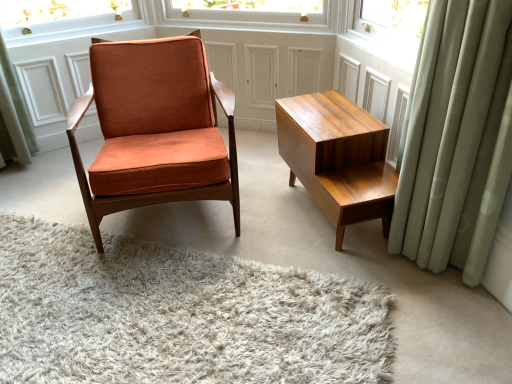
This screenshot has width=512, height=384. What do you see at coordinates (153, 122) in the screenshot?
I see `orange velvet chair at center` at bounding box center [153, 122].

Identify the location of white shag rug at center. This screenshot has height=384, width=512. pos(178,315).

In order to face white shag rug at center, should I rotate leftwards or rightwards?

To align with it, rotate left about 18.058°.

At what (x,y) coordinates should I click in order to perform the action: click on wooden table at right. Please return your answer as a coordinate pair (x, y). The width and height of the screenshot is (512, 384). Looking at the image, I should click on (338, 158).

Is white shag rug at center not inside light green fabric curtain at right?

Indeed, white shag rug at center is completely outside light green fabric curtain at right.

Looking at this image, from a real-world perspective, which object rests below the other?

white shag rug at center is physically lower.

Is white shag rug at center facing towards light green fabric curtain at right?

No, white shag rug at center is not oriented towards light green fabric curtain at right.

Locate an element on the screen. The image size is (512, 384). curtain behind the white shag rug at center is located at coordinates (456, 138).

Is wooden table at right inside or outside of light green fabric curtain at right?

wooden table at right lies outside light green fabric curtain at right.

Is wooden table at right beside light green fabric curtain at right?

There is a gap between wooden table at right and light green fabric curtain at right.

From the image's perspective, is wooden table at right located above light green fabric curtain at right?

No.

Considering the sizes of objects wooden table at right and light green fabric curtain at right in the image provided, who is smaller, wooden table at right or light green fabric curtain at right?

With smaller size is wooden table at right.

Between white shag rug at center and orange velvet chair at center, which one has larger width?

Wider between the two is white shag rug at center.

Considering the positions of points (121, 326) and (184, 183), is point (121, 326) closer to camera compared to point (184, 183)?

That is True.

Which object is positioned more to the right, white shag rug at center or orange velvet chair at center?

orange velvet chair at center is more to the right.

Looking at this image, is white shag rug at center oriented away from orange velvet chair at center?

No, white shag rug at center is not facing away from orange velvet chair at center.

From the image's perspective, is orange velvet chair at center on wooden table at right?

Yes, from the image's perspective, orange velvet chair at center is above wooden table at right.

In terms of height, does orange velvet chair at center look taller or shorter compared to wooden table at right?

Considering their sizes, orange velvet chair at center has more height than wooden table at right.

Is orange velvet chair at center not inside wooden table at right?

Absolutely, orange velvet chair at center is external to wooden table at right.

Which object is positioned more to the left, orange velvet chair at center or wooden table at right?

orange velvet chair at center.

Which object is further away from the camera, white shag rug at center or wooden table at right?

Positioned behind is wooden table at right.

Which object is thinner, white shag rug at center or wooden table at right?

With smaller width is wooden table at right.

Is white shag rug at center at the right side of wooden table at right?

No, white shag rug at center is not to the right of wooden table at right.

Is white shag rug at center oriented away from wooden table at right?

No.

Based on their positions, is wooden table at right located to the left or right of orange velvet chair at center?

From the image, it's evident that wooden table at right is to the right of orange velvet chair at center.

Is wooden table at right turned away from orange velvet chair at center?

That's not correct — wooden table at right is not looking away from orange velvet chair at center.

In the scene shown: From the image's perspective, is wooden table at right beneath orange velvet chair at center?

Yes, from the image's perspective, wooden table at right is beneath orange velvet chair at center.

Based on the photo, does wooden table at right have a smaller size compared to orange velvet chair at center?

Yes.

Would you say light green fabric curtain at right is to the left or to the right of wooden table at right in the picture?

From the image, it's evident that light green fabric curtain at right is to the right of wooden table at right.

Is light green fabric curtain at right taller than wooden table at right?

Yes, light green fabric curtain at right is taller than wooden table at right.

Considering the relative sizes of light green fabric curtain at right and wooden table at right in the image provided, is light green fabric curtain at right wider than wooden table at right?

No.

The image size is (512, 384). Identify the location of curtain above the white shag rug at center (from a real-world perspective). (456, 138).

Locate an element on the screen. This screenshot has width=512, height=384. curtain in front of the wooden table at right is located at coordinates (456, 138).

Estimate the real-world distances between objects in this image. Which object is closer to light green fabric curtain at right, orange velvet chair at center or wooden table at right?

The object closer to light green fabric curtain at right is wooden table at right.

Looking at the image, which one is located further to wooden table at right, orange velvet chair at center or light green fabric curtain at right?

Among the two, orange velvet chair at center is located further to wooden table at right.

Estimate the real-world distances between objects in this image. Which object is closer to white shag rug at center, orange velvet chair at center or light green fabric curtain at right?

orange velvet chair at center lies closer to white shag rug at center than the other object.

Considering their positions, is light green fabric curtain at right positioned closer to white shag rug at center than orange velvet chair at center?

The object closer to white shag rug at center is orange velvet chair at center.

From the image, which object appears to be farther from white shag rug at center, orange velvet chair at center or wooden table at right?

wooden table at right.

Looking at the image, which one is located further to wooden table at right, light green fabric curtain at right or orange velvet chair at center?

Among the two, orange velvet chair at center is located further to wooden table at right.

Considering their positions, is white shag rug at center positioned further to wooden table at right than orange velvet chair at center?

white shag rug at center lies further to wooden table at right than the other object.

Looking at the image, which one is located closer to white shag rug at center, wooden table at right or light green fabric curtain at right?

wooden table at right.

At what (x,y) coordinates should I click in order to perform the action: click on chair between white shag rug at center and wooden table at right. Please return your answer as a coordinate pair (x, y). The width and height of the screenshot is (512, 384). Looking at the image, I should click on (153, 122).

Where is `table located between orange velvet chair at center and light green fabric curtain at right in the left-right direction`? table located between orange velvet chair at center and light green fabric curtain at right in the left-right direction is located at coordinates (338, 158).

This screenshot has height=384, width=512. In order to click on chair located between white shag rug at center and light green fabric curtain at right in the left-right direction in this screenshot , I will do `click(153, 122)`.

Locate an element on the screen. table between white shag rug at center and light green fabric curtain at right in the horizontal direction is located at coordinates (338, 158).